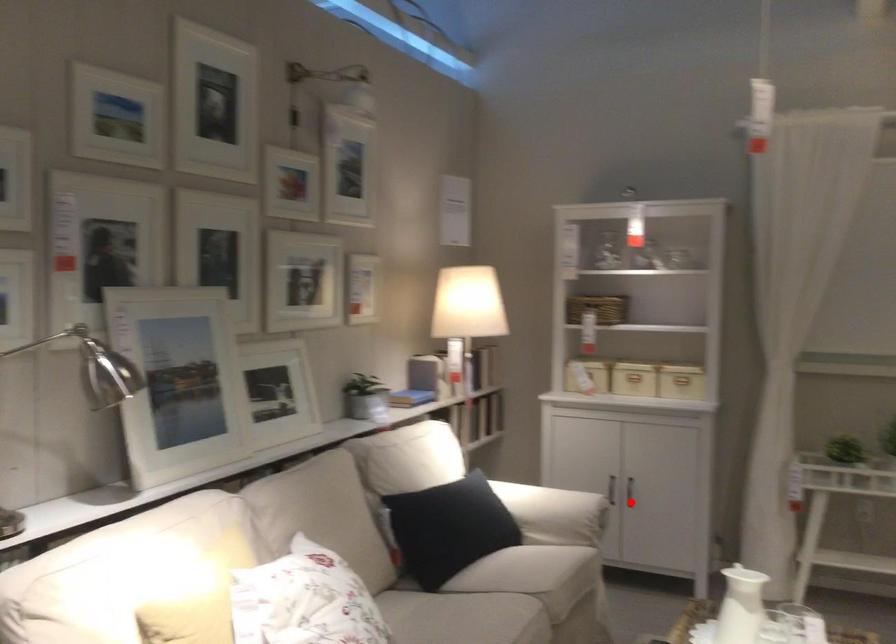
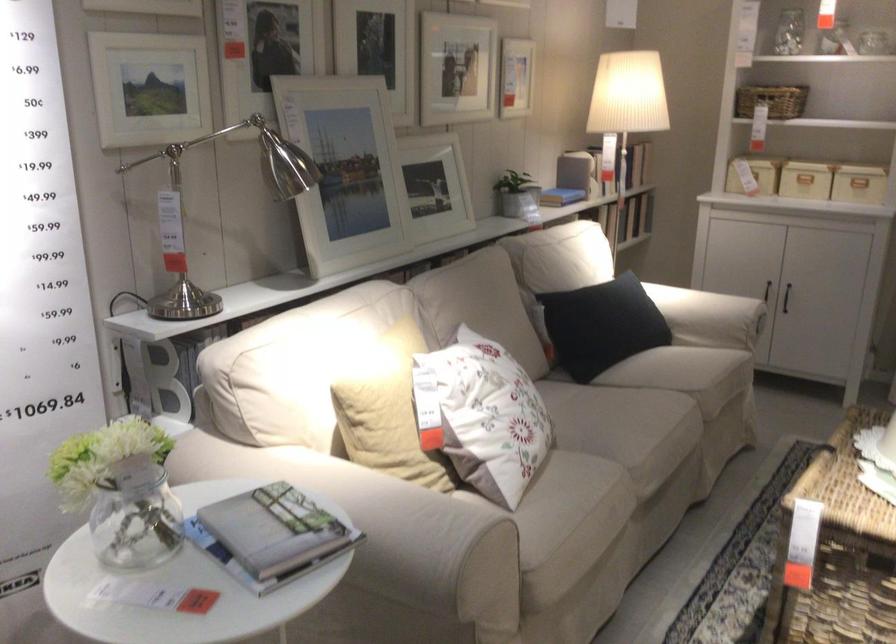
Find the pixel in the second image that matches the highlighted location in the first image.

(786, 297)